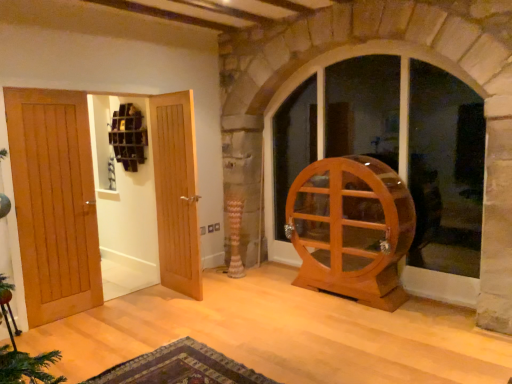
Image resolution: width=512 pixels, height=384 pixels. Find the location of `free space that is in between light brown wood door at center, which ranks as the third door in left-to-right order, and light brown wood door at left, which appears as the 2th door when viewed from the right`. free space that is in between light brown wood door at center, which ranks as the third door in left-to-right order, and light brown wood door at left, which appears as the 2th door when viewed from the right is located at coordinates (125, 309).